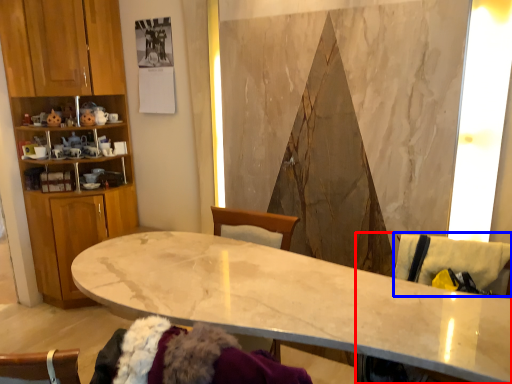
Question: Which of the following is the closest to the observer, swivel chair (highlighted by a red box) or swivel chair (highlighted by a blue box)?

Choices:
 (A) swivel chair
 (B) swivel chair

Answer: (A)